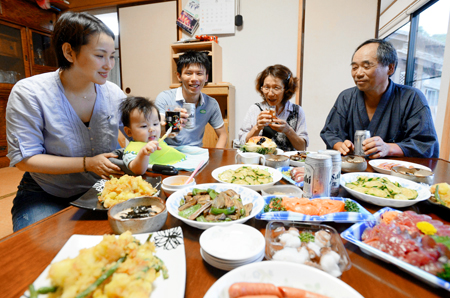
The width and height of the screenshot is (450, 298). Identify the location of windows. (432, 38).